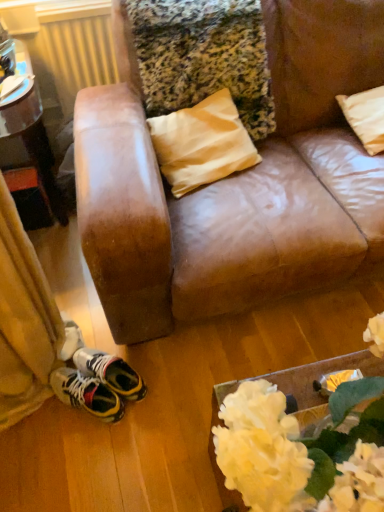
This screenshot has width=384, height=512. Find the location of `beige fabric pillow at upper right`. beige fabric pillow at upper right is located at coordinates (366, 117).

What do you see at coordinates (302, 450) in the screenshot? I see `white fabric flowers at lower right` at bounding box center [302, 450].

Image resolution: width=384 pixels, height=512 pixels. I want to click on brushed metal table at left, so click(34, 143).

Identify the location of beige fabric pillow at upper right. The height and width of the screenshot is (512, 384). (366, 117).

Is beige fabric pillow at upper right positioned beyond the bounds of brushed metal table at left?

Yes, beige fabric pillow at upper right is located beyond the bounds of brushed metal table at left.

Between beige fabric pillow at upper right and brushed metal table at left, which one has less height?

beige fabric pillow at upper right is shorter.

Is beige fabric pillow at upper right looking in the opposite direction of brushed metal table at left?

No, beige fabric pillow at upper right is not facing the opposite direction of brushed metal table at left.

Considering the sizes of brushed metal table at left and white fabric flowers at lower right in the image, is brushed metal table at left bigger or smaller than white fabric flowers at lower right?

Clearly, brushed metal table at left is larger in size than white fabric flowers at lower right.

Based on the photo, is brushed metal table at left surrounding white fabric flowers at lower right?

Definitely not — white fabric flowers at lower right is not inside brushed metal table at left.

Is beige fabric pillow at upper right positioned in front of metallic yellow radiator at upper left?

Yes, it is in front of metallic yellow radiator at upper left.

What's the angular difference between beige fabric pillow at upper right and metallic yellow radiator at upper left's facing directions?

0.487 degrees separate the facing orientations of beige fabric pillow at upper right and metallic yellow radiator at upper left.

Is point (344, 100) positioned in front of point (64, 13)?

That is True.

Can you confirm if beige fabric pillow at upper right is wider than metallic yellow radiator at upper left?

Correct, the width of beige fabric pillow at upper right exceeds that of metallic yellow radiator at upper left.

Between point (260, 409) and point (44, 110), which one is positioned behind?

The point (44, 110) is more distant.

From the image's perspective, between white fabric flowers at lower right and metallic yellow radiator at upper left, which one is located above?

metallic yellow radiator at upper left is shown above in the image.

From a real-world perspective, which object stands above the other?

white fabric flowers at lower right is physically above.

You are a GUI agent. You are given a task and a screenshot of the screen. Output one action in this format:
    pyautogui.click(x=<x>, y=<y>)
    Task: Click on the floral arrangement in front of the metallic yellow radiator at upper left
    Image resolution: width=384 pixels, height=512 pixels.
    Given the screenshot: What is the action you would take?
    pyautogui.click(x=302, y=450)

Are metallic yellow radiator at upper left and white fabric flowers at lower right located far from each other?

Yes, metallic yellow radiator at upper left and white fabric flowers at lower right are quite far apart.

Can you confirm if metallic yellow radiator at upper left is smaller than white fabric flowers at lower right?

Correct, metallic yellow radiator at upper left occupies less space than white fabric flowers at lower right.

Which is more distant, (70,19) or (345,450)?

The point (70,19) is more distant.

Is brushed metal table at left next to metallic yellow radiator at upper left?

No, brushed metal table at left is not with metallic yellow radiator at upper left.

Image resolution: width=384 pixels, height=512 pixels. In the image, there is a metallic yellow radiator at upper left. What are the coordinates of `table below it (from the image's perspective)` in the screenshot? It's located at (34, 143).

Which object is positioned more to the right, brushed metal table at left or metallic yellow radiator at upper left?

→ metallic yellow radiator at upper left is more to the right.

Considering the sizes of objects white fabric flowers at lower right and brushed metal table at left in the image provided, who is smaller, white fabric flowers at lower right or brushed metal table at left?

white fabric flowers at lower right.

Is brushed metal table at left at the back of white fabric flowers at lower right?

Yes, brushed metal table at left is at the back of white fabric flowers at lower right.

The width and height of the screenshot is (384, 512). Find the location of `floral arrangement below the brushed metal table at left (from the image's perspective)`. floral arrangement below the brushed metal table at left (from the image's perspective) is located at coordinates (302, 450).

Is white fabric flowers at lower right inside the boundaries of brushed metal table at left, or outside?

white fabric flowers at lower right cannot be found inside brushed metal table at left.

Locate an element on the screen. This screenshot has height=512, width=384. pillow that appears behind the brushed metal table at left is located at coordinates (366, 117).

Locate an element on the screen. floral arrangement that is below the brushed metal table at left (from the image's perspective) is located at coordinates (302, 450).

When comparing their distances from brushed metal table at left, does metallic yellow radiator at upper left or white fabric flowers at lower right seem further?

Based on the image, white fabric flowers at lower right appears to be further to brushed metal table at left.

From the image, which object appears to be nearer to beige fabric pillow at upper right, white fabric flowers at lower right or metallic yellow radiator at upper left?

metallic yellow radiator at upper left.

Estimate the real-world distances between objects in this image. Which object is closer to metallic yellow radiator at upper left, brushed metal table at left or white fabric flowers at lower right?

brushed metal table at left is closer to metallic yellow radiator at upper left.

When comparing their distances from metallic yellow radiator at upper left, does brushed metal table at left or beige fabric pillow at upper right seem closer?

brushed metal table at left is positioned closer to the anchor metallic yellow radiator at upper left.

Looking at the image, which one is located further to white fabric flowers at lower right, brushed metal table at left or metallic yellow radiator at upper left?

metallic yellow radiator at upper left lies further to white fabric flowers at lower right than the other object.

Considering their positions, is metallic yellow radiator at upper left positioned closer to white fabric flowers at lower right than brushed metal table at left?

The object closer to white fabric flowers at lower right is brushed metal table at left.

Estimate the real-world distances between objects in this image. Which object is closer to beige fabric pillow at upper right, brushed metal table at left or white fabric flowers at lower right?

Based on the image, white fabric flowers at lower right appears to be nearer to beige fabric pillow at upper right.

Looking at the image, which one is located further to metallic yellow radiator at upper left, white fabric flowers at lower right or beige fabric pillow at upper right?

white fabric flowers at lower right.

Find the location of a particular element. floral arrangement situated between brushed metal table at left and beige fabric pillow at upper right from left to right is located at coordinates (302, 450).

In order to click on pillow located between white fabric flowers at lower right and metallic yellow radiator at upper left in the depth direction in this screenshot , I will do `click(366, 117)`.

At what (x,y) coordinates should I click in order to perform the action: click on radiator located between brushed metal table at left and beige fabric pillow at upper right in the left-right direction. Please return your answer as a coordinate pair (x, y). This screenshot has width=384, height=512. Looking at the image, I should click on (71, 57).

You are a GUI agent. You are given a task and a screenshot of the screen. Output one action in this format:
    pyautogui.click(x=<x>, y=<y>)
    Task: Click on the table located between white fabric flowers at lower right and metallic yellow radiator at upper left in the depth direction
    The height and width of the screenshot is (512, 384).
    Given the screenshot: What is the action you would take?
    pyautogui.click(x=34, y=143)